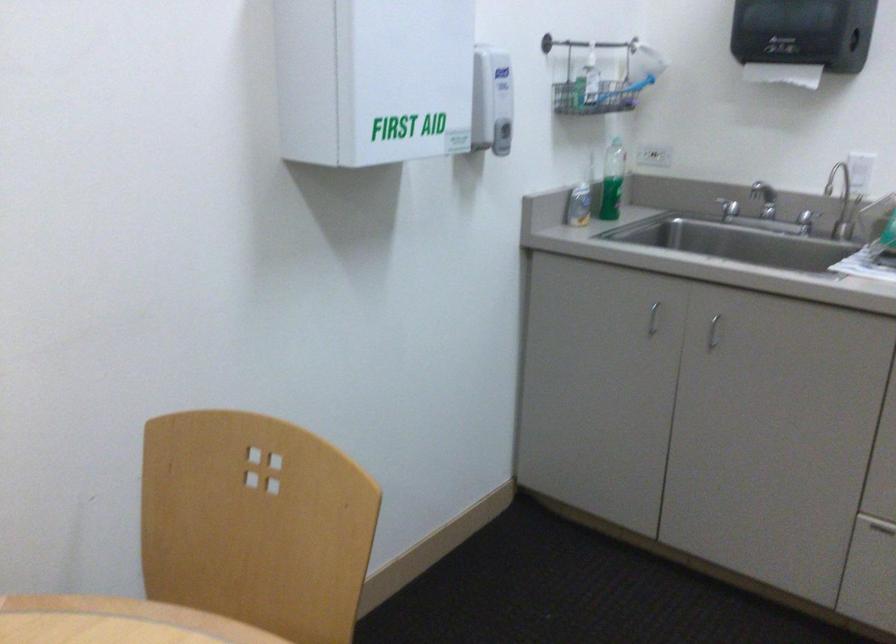
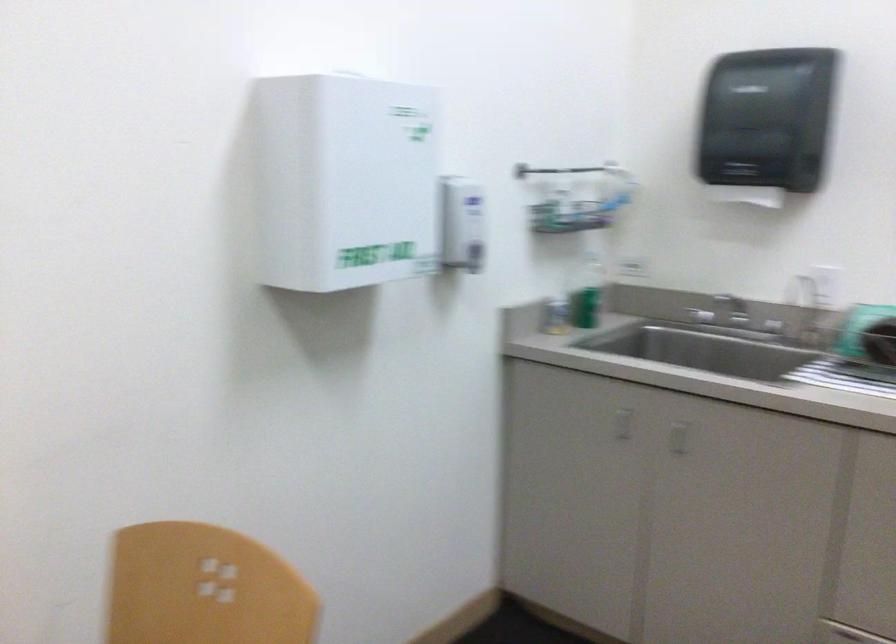
Question: The images are taken continuously from a first-person perspective. In which direction is your viewpoint rotating?

Choices:
 (A) Left
 (B) Right
 (C) Up
 (D) Down

Answer: (C)